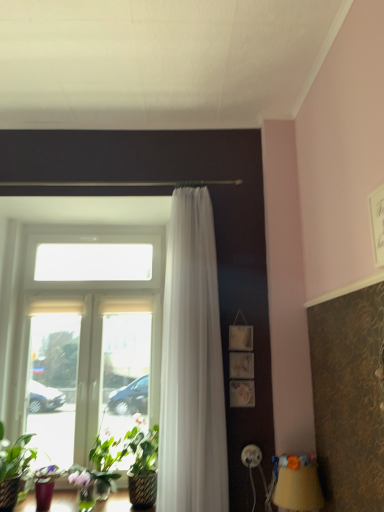
The width and height of the screenshot is (384, 512). Describe the element at coordinates (85, 335) in the screenshot. I see `clear glass window at center` at that location.

Find the location of `yellow fabric lampshade at lower right`. yellow fabric lampshade at lower right is located at coordinates (298, 484).

I want to click on white sheer curtain at center, so click(192, 365).

Where is `clear glass window at center`? clear glass window at center is located at coordinates (85, 335).

Can you confirm if green leafy plant at lower left is bigger than clear glass window at center?

Incorrect, green leafy plant at lower left is not larger than clear glass window at center.

Identify the location of window above the green leafy plant at lower left (from a real-world perspective). This screenshot has height=512, width=384. point(85,335).

Is clear glass window at center located within green leafy plant at lower left?

No, clear glass window at center is located outside of green leafy plant at lower left.

From a real-world perspective, relative to clear glass window at center, is green leafy plant at lower left vertically above or below?

Clearly, from a real-world perspective, green leafy plant at lower left is below clear glass window at center.

Is green leafy plant at lower left touching yellow fabric lampshade at lower right?

No, green leafy plant at lower left is not with yellow fabric lampshade at lower right.

How many degrees apart are the facing directions of green leafy plant at lower left and yellow fabric lampshade at lower right?

green leafy plant at lower left and yellow fabric lampshade at lower right are facing 88.7 degrees away from each other.

Between point (7, 475) and point (312, 485), which one is positioned in front?

Positioned in front is point (312, 485).

In terms of size, does green leafy plant at lower left appear bigger or smaller than yellow fabric lampshade at lower right?

green leafy plant at lower left is bigger than yellow fabric lampshade at lower right.

You are a GUI agent. You are given a task and a screenshot of the screen. Output one action in this format:
    pyautogui.click(x=<x>, y=<y>)
    Task: Click on the table lamp to the right of white sheer curtain at center
    Image resolution: width=384 pixels, height=512 pixels.
    Given the screenshot: What is the action you would take?
    pyautogui.click(x=298, y=484)

Is white sheer curtain at center spatially inside yellow fabric lampshade at lower right, or outside of it?

white sheer curtain at center is outside yellow fabric lampshade at lower right.

From the image's perspective, is white sheer curtain at center located above or below yellow fabric lampshade at lower right?

white sheer curtain at center is above yellow fabric lampshade at lower right.

Measure the distance between clear glass window at center and yellow fabric lampshade at lower right.

5.18 feet.

From the image's perspective, is clear glass window at center over yellow fabric lampshade at lower right?

Correct, clear glass window at center appears higher than yellow fabric lampshade at lower right in the image.

Who is bigger, clear glass window at center or yellow fabric lampshade at lower right?

clear glass window at center.

Is there a large distance between clear glass window at center and yellow fabric lampshade at lower right?

Yes, clear glass window at center and yellow fabric lampshade at lower right are located far from each other.

Is white sheer curtain at center touching green leafy plant at lower left?

No, white sheer curtain at center is not in contact with green leafy plant at lower left.

Would you say white sheer curtain at center contains green leafy plant at lower left?

Actually, green leafy plant at lower left is outside white sheer curtain at center.

From a real-world perspective, is white sheer curtain at center positioned under green leafy plant at lower left based on gravity?

No, from a real-world perspective, white sheer curtain at center is not below green leafy plant at lower left.

In terms of width, does white sheer curtain at center look wider or thinner when compared to green leafy plant at lower left?

Considering their sizes, white sheer curtain at center looks slimmer than green leafy plant at lower left.

From the picture: Is yellow fabric lampshade at lower right beside clear glass window at center?

No, yellow fabric lampshade at lower right is not making contact with clear glass window at center.

Where is `table lamp below the clear glass window at center (from the image's perspective)`? table lamp below the clear glass window at center (from the image's perspective) is located at coordinates (298, 484).

Is yellow fabric lampshade at lower right oriented away from clear glass window at center?

No, yellow fabric lampshade at lower right is not facing the opposite direction of clear glass window at center.

Does point (315, 463) lie in front of point (154, 406)?

Yes, it is.

In the scene shown: Looking at the image, does green leafy plant at lower left seem bigger or smaller compared to white sheer curtain at center?

In the image, green leafy plant at lower left appears to be smaller than white sheer curtain at center.

Considering the relative sizes of green leafy plant at lower left and white sheer curtain at center in the image provided, is green leafy plant at lower left shorter than white sheer curtain at center?

Indeed, green leafy plant at lower left has a lesser height compared to white sheer curtain at center.

Which is correct: green leafy plant at lower left is inside white sheer curtain at center, or outside of it?

green leafy plant at lower left exists outside the volume of white sheer curtain at center.

From the image's perspective, who appears lower, green leafy plant at lower left or white sheer curtain at center?

green leafy plant at lower left is shown below in the image.

Find the location of a particular element. The image size is (384, 512). window that is behind the green leafy plant at lower left is located at coordinates (85, 335).

Locate an element on the screen. The image size is (384, 512). table lamp in front of the green leafy plant at lower left is located at coordinates (298, 484).

Based on their spatial positions, is white sheer curtain at center or yellow fabric lampshade at lower right closer to clear glass window at center?

white sheer curtain at center.

Based on their spatial positions, is green leafy plant at lower left or yellow fabric lampshade at lower right closer to white sheer curtain at center?

The object closer to white sheer curtain at center is yellow fabric lampshade at lower right.

Estimate the real-world distances between objects in this image. Which object is closer to white sheer curtain at center, yellow fabric lampshade at lower right or clear glass window at center?

yellow fabric lampshade at lower right.

Based on the photo, looking at the image, which one is located further to clear glass window at center, yellow fabric lampshade at lower right or green leafy plant at lower left?

yellow fabric lampshade at lower right lies further to clear glass window at center than the other object.

Considering their positions, is white sheer curtain at center positioned further to green leafy plant at lower left than clear glass window at center?

Among the two, white sheer curtain at center is located further to green leafy plant at lower left.

From the image, which object appears to be farther from white sheer curtain at center, clear glass window at center or green leafy plant at lower left?

Among the two, green leafy plant at lower left is located further to white sheer curtain at center.

Estimate the real-world distances between objects in this image. Which object is closer to white sheer curtain at center, clear glass window at center or yellow fabric lampshade at lower right?

Among the two, yellow fabric lampshade at lower right is located nearer to white sheer curtain at center.

Which object lies further to the anchor point green leafy plant at lower left, clear glass window at center or yellow fabric lampshade at lower right?

Based on the image, yellow fabric lampshade at lower right appears to be further to green leafy plant at lower left.

Identify the location of curtain between green leafy plant at lower left and yellow fabric lampshade at lower right. (192, 365).

I want to click on window between green leafy plant at lower left and white sheer curtain at center, so click(85, 335).

The height and width of the screenshot is (512, 384). What are the coordinates of `window located between green leafy plant at lower left and yellow fabric lampshade at lower right in the left-right direction` in the screenshot? It's located at (85, 335).

At what (x,y) coordinates should I click in order to perform the action: click on curtain between clear glass window at center and yellow fabric lampshade at lower right in the horizontal direction. Please return your answer as a coordinate pair (x, y). Looking at the image, I should click on coord(192,365).